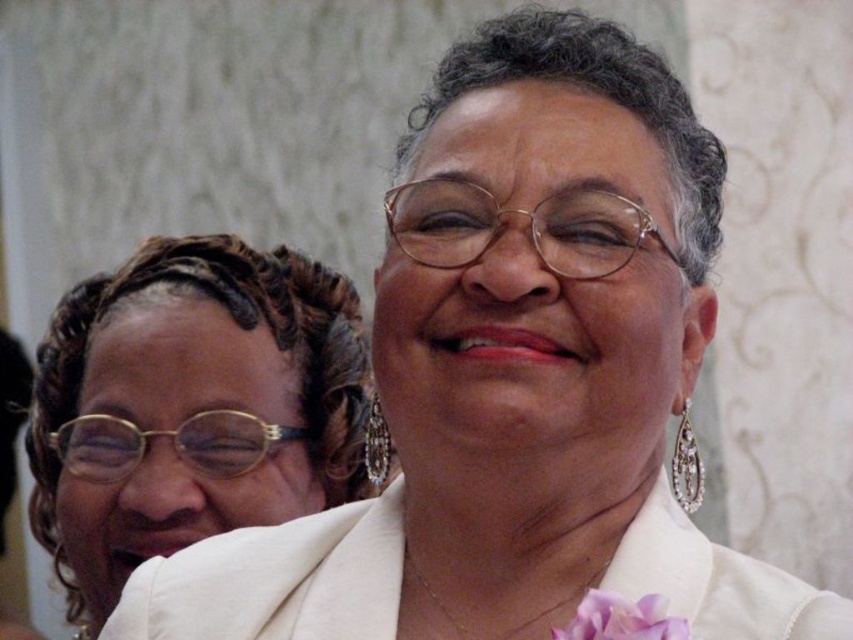
You are a photographer adjusting your camera settings to capture the scene. You need to focus on both the matte gold glasses at upper left and the purple silk flower at lower center. Which object should you adjust your focus to first to ensure both are in sharp detail?

The matte gold glasses at upper left is bigger than the purple silk flower at lower center, so you should focus on the matte gold glasses at upper left first to ensure both are in sharp detail.